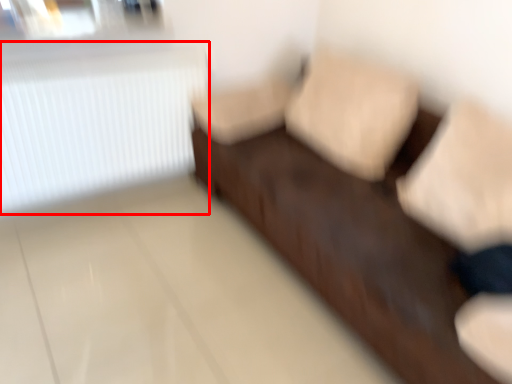
Question: From the image's perspective, what is the correct spatial relationship of radiator (annotated by the red box) in relation to furniture?

Choices:
 (A) above
 (B) below

Answer: (A)